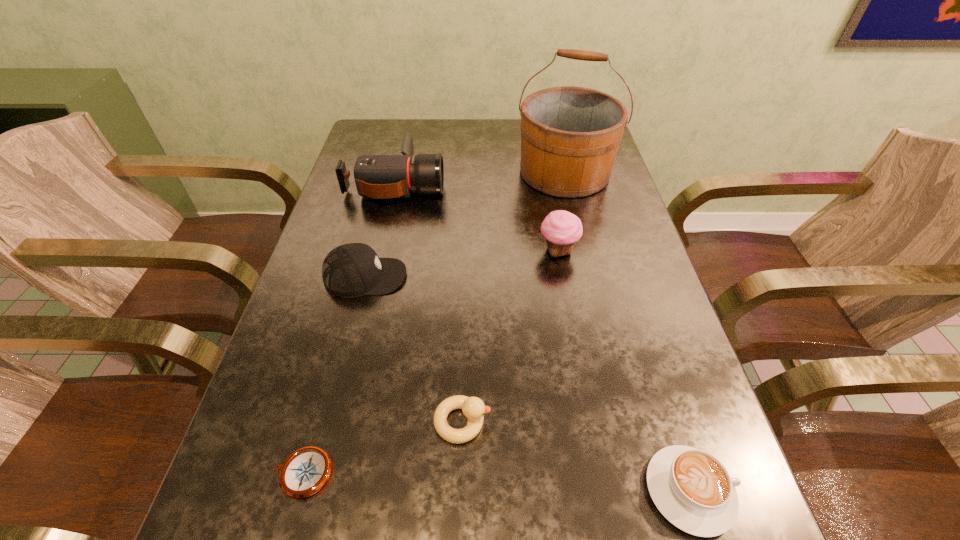
Find the location of a particular element. This screenshot has height=540, width=960. cappuccino at the right edge is located at coordinates [x=692, y=489].

Locate an element on the screen. This screenshot has width=960, height=540. object that is at the far right corner is located at coordinates (570, 136).

Image resolution: width=960 pixels, height=540 pixels. Identify the location of blank area at the far edge. (504, 128).

Where is `free space at the left edge`? This screenshot has height=540, width=960. free space at the left edge is located at coordinates (359, 305).

Locate an element on the screen. This screenshot has width=960, height=540. vacant space at the right edge is located at coordinates (624, 260).

Where is `vacant space at the far left corner of the desktop`? The image size is (960, 540). vacant space at the far left corner of the desktop is located at coordinates (385, 131).

Find the location of a particular element. This screenshot has width=960, height=540. free space between the fifth farthest object and the fourth tallest object is located at coordinates click(x=414, y=349).

Identify the location of free space between the camcorder and the bucket. (480, 178).

Locate an element on the screen. This screenshot has height=540, width=960. free space that is in between the fourth object from left to right and the cap is located at coordinates (414, 349).

Locate an element on the screen. This screenshot has width=960, height=540. free spot between the camcorder and the third nearest object is located at coordinates (429, 302).